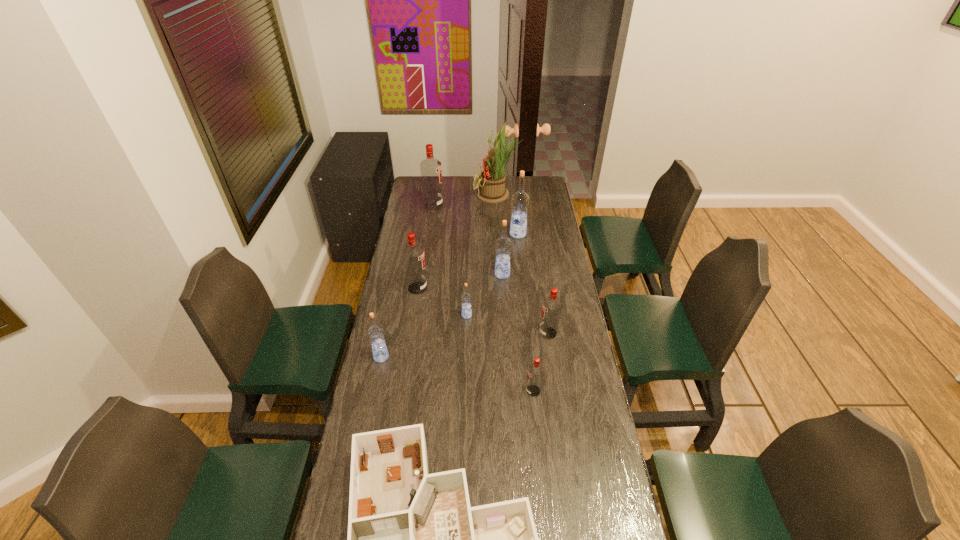
Locate an element on the screen. the second nearest vodka is located at coordinates (375, 333).

Find the location of a particular element. The width and height of the screenshot is (960, 540). the second nearest red vodka is located at coordinates (551, 306).

Find the location of a particular element. The width and height of the screenshot is (960, 540). the second smallest red vodka is located at coordinates (551, 306).

This screenshot has width=960, height=540. Find the location of `the third red vodka from left to right`. the third red vodka from left to right is located at coordinates (535, 371).

Where is `the nearest vodka`? the nearest vodka is located at coordinates (535, 371).

At what (x,y) coordinates should I click in order to perform the action: click on the second nearest blue vodka. Please return your answer as a coordinate pair (x, y). The height and width of the screenshot is (540, 960). Looking at the image, I should click on (466, 298).

Find the location of a particular element. the fifth nearest object is located at coordinates (466, 298).

You are a GUI agent. You are given a task and a screenshot of the screen. Output one action in this format:
    pyautogui.click(x=<x>, y=<y>)
    Task: Click on the free space located in front of the flower arrangement with the fan visible
    Image resolution: width=960 pixels, height=540 pixels.
    Given the screenshot: What is the action you would take?
    [447, 194]

Identify the location of free space located in front of the flower arrangement with the fan visible. (462, 194).

You are a GUI agent. You are given a task and a screenshot of the screen. Output one action in this format:
    pyautogui.click(x=<x>, y=<y>)
    Task: Click on the free region located 0.210m in front of the flower arrangement with the fan visible
    This screenshot has height=540, width=960.
    Given the screenshot: What is the action you would take?
    pyautogui.click(x=437, y=194)